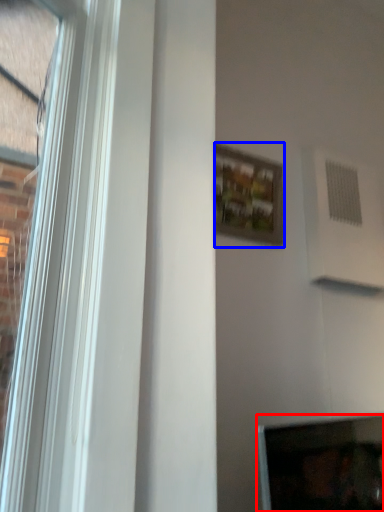
Question: Which point is further to the camera, computer screen (highlighted by a red box) or picture frame (highlighted by a blue box)?

Choices:
 (A) computer screen
 (B) picture frame

Answer: (B)